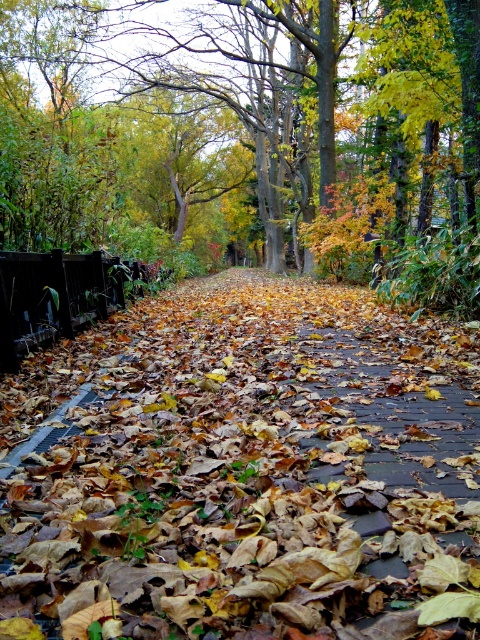
You are a gardener who needs to trim the green leafy tree at center and the brown stone pavement at center. Which object is taller?

The green leafy tree at center is taller than the brown stone pavement at center.

You are walking along the autumn pathway and want to step onto the brown stone pavement at center. Which direction should you move relative to the green leafy tree at center?

You should move to the right of the green leafy tree at center to reach the brown stone pavement at center, since the brown stone pavement at center is located to the right of the green leafy tree at center.